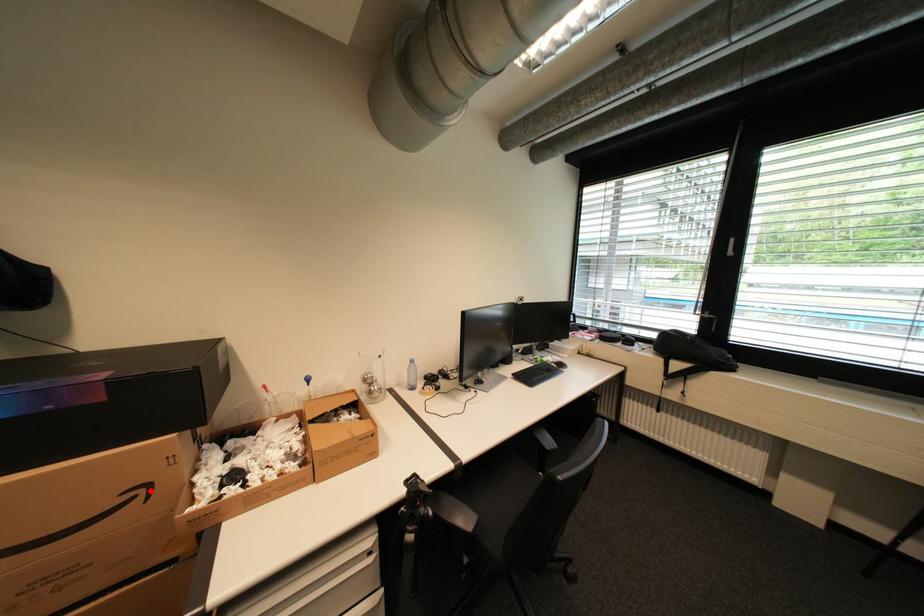
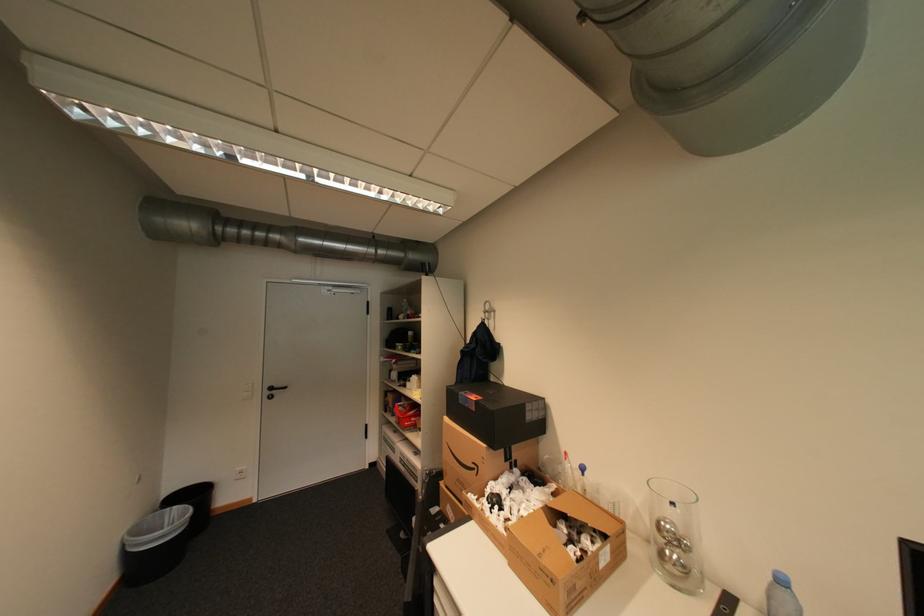
Question: I am providing you with two images of the same scene from different viewpoints. A red point is marked on the first image. Can you still see the location of the red point in image 2?

Choices:
 (A) Yes
 (B) No

Answer: (A)